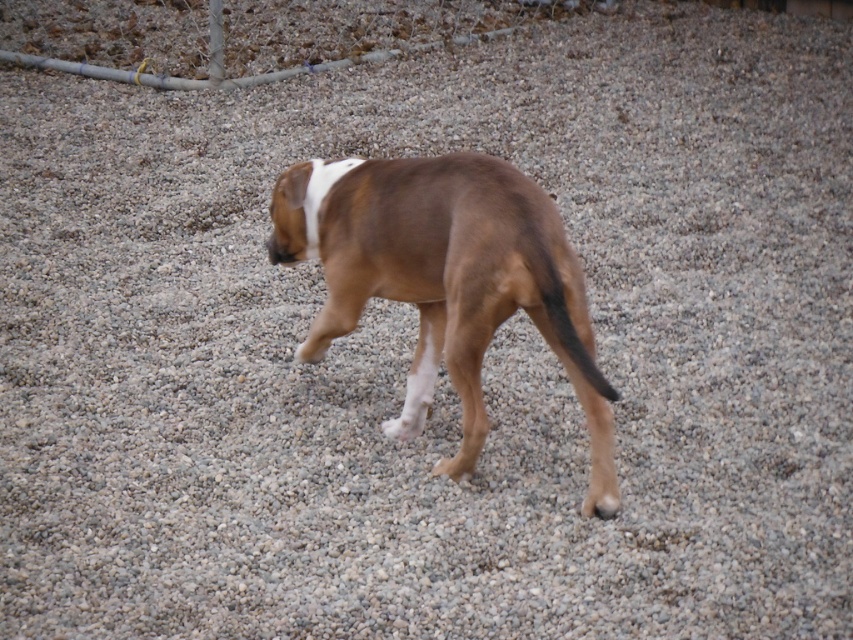
Question: Can you confirm if brown matte dog at center is positioned below brown matte tail at center?

Choices:
 (A) no
 (B) yes

Answer: (A)

Question: Is brown matte dog at center wider than brown matte tail at center?

Choices:
 (A) no
 (B) yes

Answer: (B)

Question: Which of the following is the farthest from the observer?

Choices:
 (A) brown matte tail at center
 (B) brown matte dog at center

Answer: (B)

Question: Does brown matte dog at center have a larger size compared to brown matte tail at center?

Choices:
 (A) no
 (B) yes

Answer: (B)